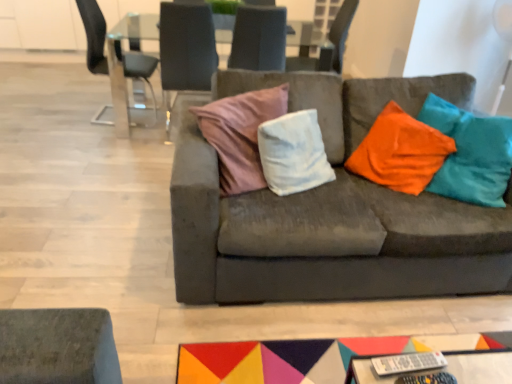
Question: From the image's perspective, does metallic glass chair at upper left, the first chair from the left, appear higher than velvet cushion at center, the third chair when ordered from right to left?

Choices:
 (A) no
 (B) yes

Answer: (B)

Question: From a real-world perspective, is metallic glass chair at upper left, the first chair from the left, located higher than velvet cushion at center, the third chair when ordered from right to left?

Choices:
 (A) no
 (B) yes

Answer: (A)

Question: Considering the relative sizes of metallic glass chair at upper left, which is the 4th chair in right-to-left order, and velvet cushion at center, the third chair when ordered from right to left, in the image provided, is metallic glass chair at upper left, which is the 4th chair in right-to-left order, shorter than velvet cushion at center, the third chair when ordered from right to left,?

Choices:
 (A) no
 (B) yes

Answer: (B)

Question: Is metallic glass chair at upper left, which is the 4th chair in right-to-left order, not near velvet cushion at center, the second chair from the left?

Choices:
 (A) no
 (B) yes

Answer: (A)

Question: Does metallic glass chair at upper left, the first chair from the left, have a smaller size compared to velvet cushion at center, the second chair from the left?

Choices:
 (A) no
 (B) yes

Answer: (B)

Question: Is point pyautogui.click(x=323, y=56) closer or farther from the camera than point pyautogui.click(x=209, y=18)?

Choices:
 (A) farther
 (B) closer

Answer: (A)

Question: From the image's perspective, relative to velvet cushion at center, the third chair when ordered from right to left, is suede-like gray chair at upper center, which is the 1th chair from right to left, above or below?

Choices:
 (A) below
 (B) above

Answer: (B)

Question: In terms of width, does suede-like gray chair at upper center, which is the 1th chair from right to left, look wider or thinner when compared to velvet cushion at center, the third chair when ordered from right to left?

Choices:
 (A) wide
 (B) thin

Answer: (A)

Question: Considering the positions of suede-like gray chair at upper center, placed as the 4th chair when sorted from left to right, and velvet cushion at center, the second chair from the left, in the image, is suede-like gray chair at upper center, placed as the 4th chair when sorted from left to right, bigger or smaller than velvet cushion at center, the second chair from the left,?

Choices:
 (A) big
 (B) small

Answer: (B)

Question: Based on their positions, is suede-like gray chair at upper center, the 2th chair viewed from the right, located to the left or right of transparent glass table at upper center?

Choices:
 (A) left
 (B) right

Answer: (B)

Question: Considering the positions of point (251, 16) and point (315, 38), is point (251, 16) closer or farther from the camera than point (315, 38)?

Choices:
 (A) farther
 (B) closer

Answer: (B)

Question: Is suede-like gray chair at upper center, placed as the third chair when sorted from left to right, wider or thinner than transparent glass table at upper center?

Choices:
 (A) thin
 (B) wide

Answer: (A)

Question: From a real-world perspective, is suede-like gray chair at upper center, the 2th chair viewed from the right, physically located above or below transparent glass table at upper center?

Choices:
 (A) below
 (B) above

Answer: (B)

Question: From the image's perspective, relative to suede-like gray chair at upper center, placed as the 4th chair when sorted from left to right, is velvet cushion at center, the third chair when ordered from right to left, above or below?

Choices:
 (A) above
 (B) below

Answer: (B)

Question: In terms of width, does velvet cushion at center, the third chair when ordered from right to left, look wider or thinner when compared to suede-like gray chair at upper center, which is the 1th chair from right to left?

Choices:
 (A) thin
 (B) wide

Answer: (A)